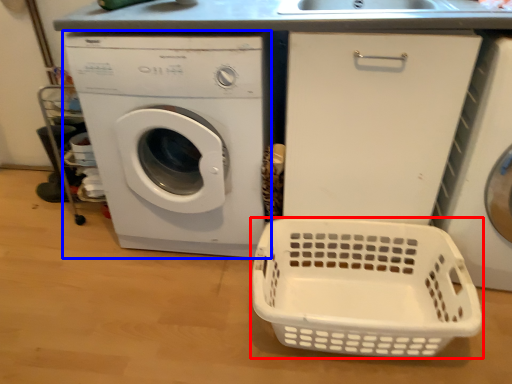
Question: Which object appears closest to the camera in this image, basket (highlighted by a red box) or washing machine (highlighted by a blue box)?

Choices:
 (A) basket
 (B) washing machine

Answer: (A)